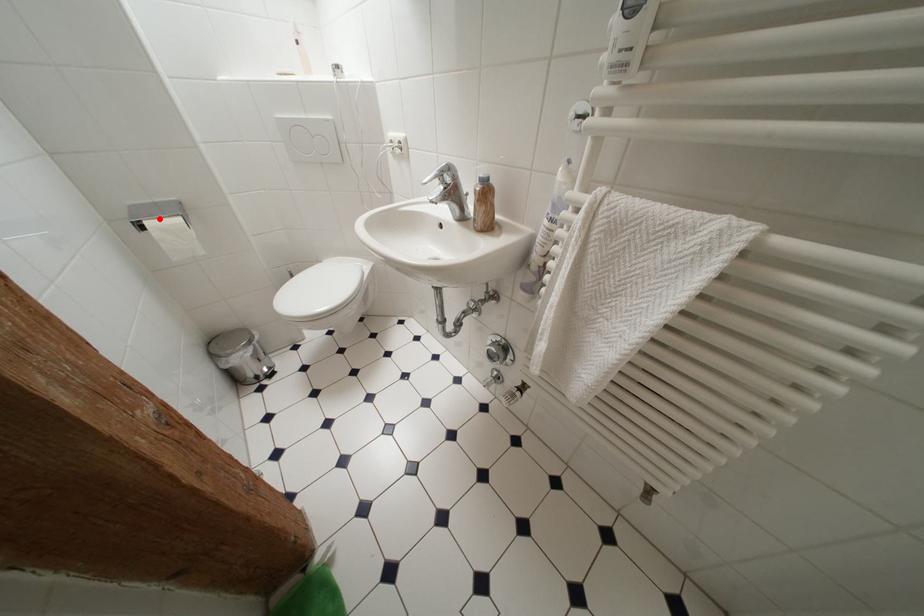
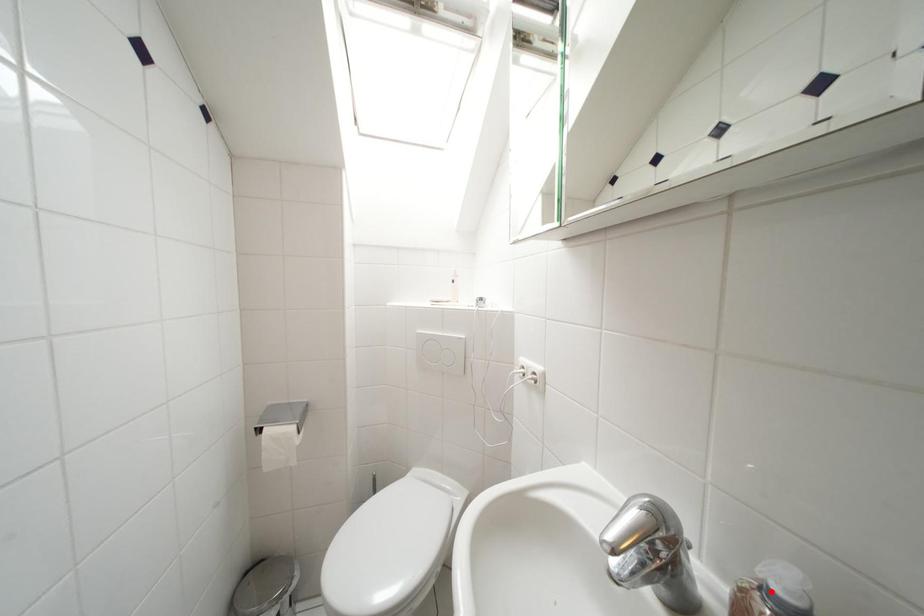
I am providing you with two images of the same scene from different viewpoints. A red point is marked on the first image and another point is marked on the second image. Is the marked point in image1 the same physical position as the marked point in image2?

No